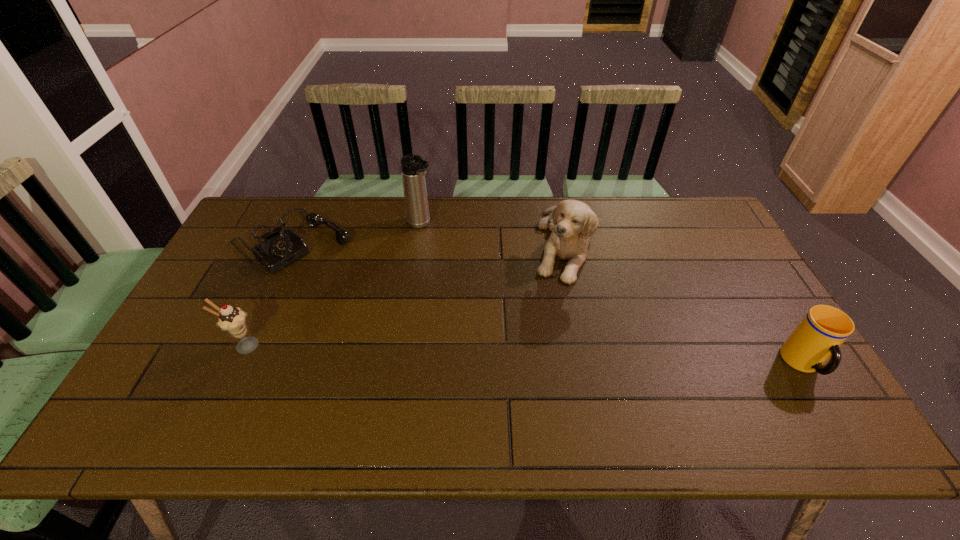
Identify the location of free spot on the desktop that is between the icecream and the cup and is positioned on the front-facing side of the fourth object from left to right. (560, 356).

This screenshot has width=960, height=540. What are the coordinates of `vacant spot on the desktop that is between the icecream and the rightmost object and is positioned on the handle side of the third object from left to right` in the screenshot? It's located at (573, 357).

I want to click on free space on the desktop that is between the icecream and the rightmost object and is positioned on the dial of the shortest object, so click(439, 353).